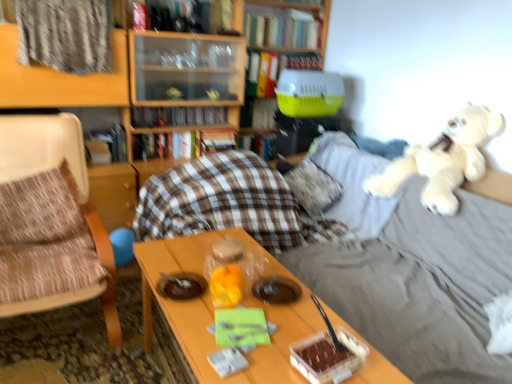
Where is `blank space situated above hardcover book at center, which is the seventh book in top-to-bottom order (from a real-world perspective)`? This screenshot has height=384, width=512. blank space situated above hardcover book at center, which is the seventh book in top-to-bottom order (from a real-world perspective) is located at coordinates (260, 129).